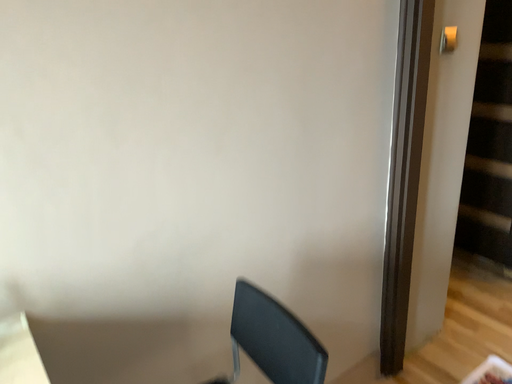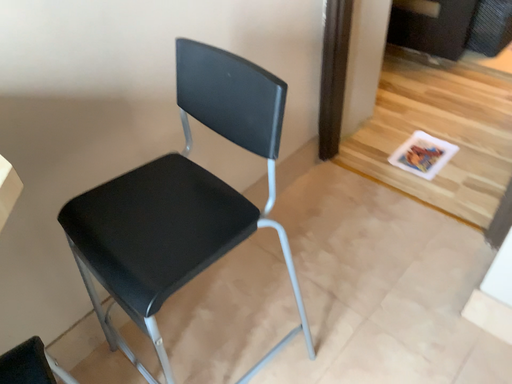
Question: Which way did the camera rotate in the video?

Choices:
 (A) rotated downward
 (B) rotated upward

Answer: (A)